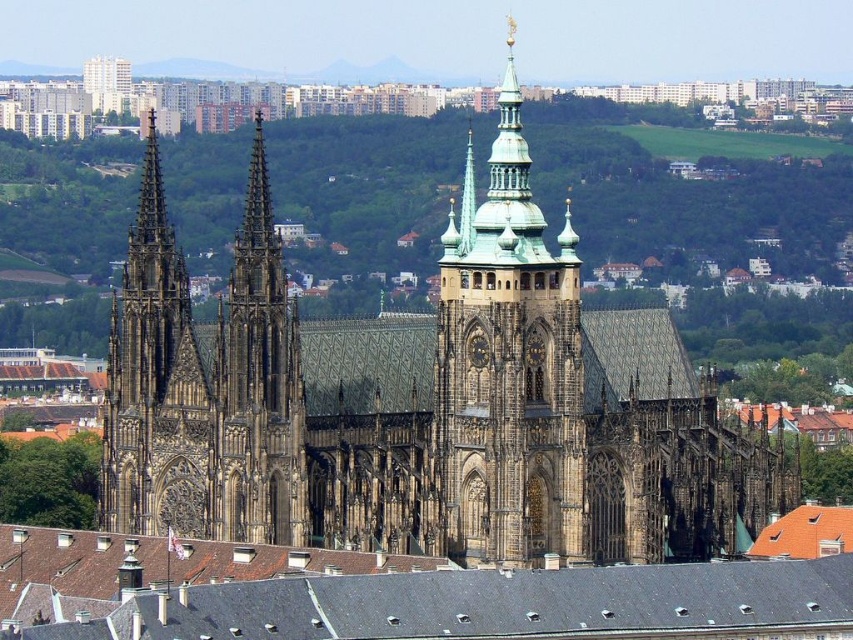
Question: Does golden stone tower at center appear on the left side of dark brown stone tower at center?

Choices:
 (A) yes
 (B) no

Answer: (B)

Question: Considering the relative positions of dark brown stone tower at left and green-golden stone spire at upper center in the image provided, where is dark brown stone tower at left located with respect to green-golden stone spire at upper center?

Choices:
 (A) below
 (B) above

Answer: (A)

Question: Is brown stone church at center bigger than green-golden stone spire at upper center?

Choices:
 (A) yes
 (B) no

Answer: (A)

Question: Considering the real-world distances, which object is closest to the dark brown stone tower at left?

Choices:
 (A) golden stone tower at center
 (B) brown stone church at center
 (C) green-golden stone spire at upper center

Answer: (B)

Question: Considering the real-world distances, which object is closest to the dark brown stone tower at left?

Choices:
 (A) dark brown stone tower at center
 (B) brown stone church at center
 (C) green-golden stone spire at upper center
 (D) golden stone tower at center

Answer: (A)

Question: Which of the following is the closest to the observer?

Choices:
 (A) dark brown stone tower at left
 (B) golden stone tower at center
 (C) brown stone church at center
 (D) dark brown stone tower at center

Answer: (C)